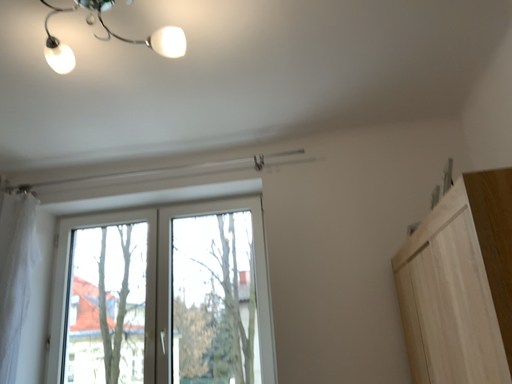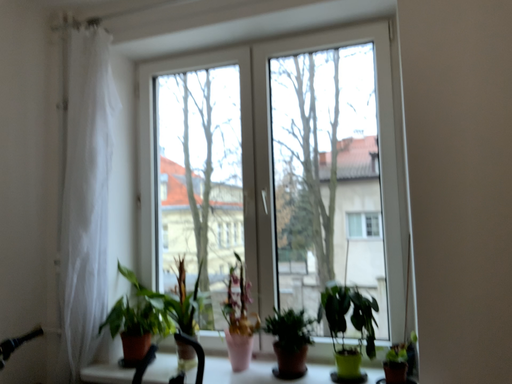
Question: Which way did the camera rotate in the video?

Choices:
 (A) rotated left
 (B) rotated right

Answer: (A)